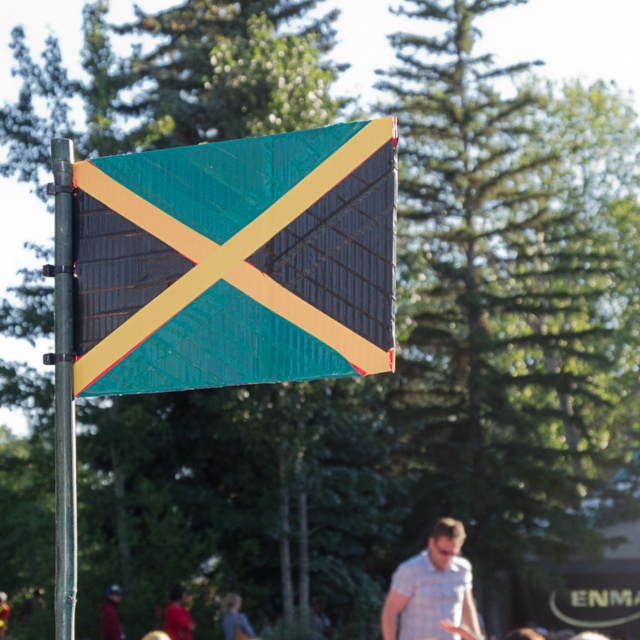
You are a tailor measuring shirts for a customer. You have two shirts in front of you, a light blue plaid shirt at center and a matte black shirt at center. Which shirt has a greater width? Please provide your answer based on the image.

The light blue plaid shirt at center has a greater width than the matte black shirt at center according to the description.

You are a fashion designer observing a model wearing a blue denim shirt at lower center and a dark red fabric at lower left. Which piece of clothing is smaller in size?

The blue denim shirt at lower center has a smaller size compared to the dark red fabric at lower left, so the blue denim shirt at lower center is smaller.

You are a fashion designer observing a model wearing a blue denim shirt at lower center and a dark red fabric at lower left. Which clothing item is closer to the ground?

The blue denim shirt at lower center is positioned under the dark red fabric at lower left, so it is closer to the ground.